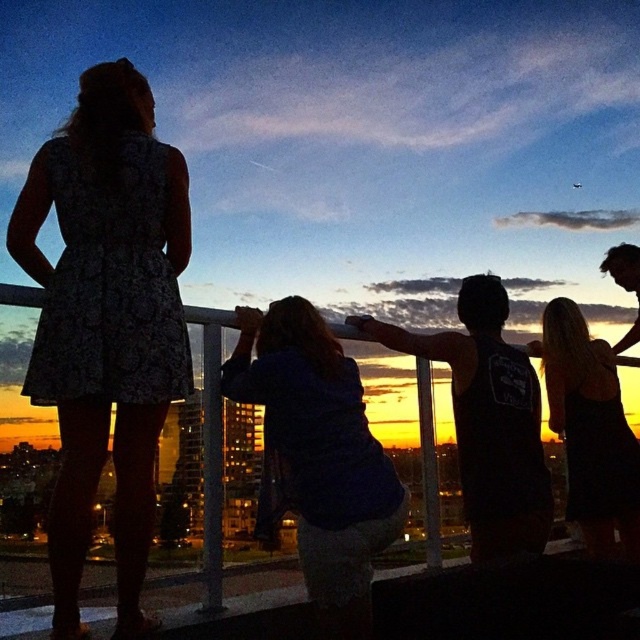
Question: Which point is closer to the camera taking this photo?

Choices:
 (A) (340, 500)
 (B) (612, 426)
 (C) (72, 122)

Answer: (C)

Question: Is floral dress at left behind satin black dress at upper right?

Choices:
 (A) yes
 (B) no

Answer: (B)

Question: Estimate the real-world distances between objects in this image. Which object is farther from the floral dress at left?

Choices:
 (A) satin black dress at upper right
 (B) blue denim shirt at center

Answer: (A)

Question: Among these points, which one is farthest from the camera?

Choices:
 (A) (122, 253)
 (B) (625, 456)
 (C) (310, 317)

Answer: (B)

Question: Can you confirm if blue denim shirt at center is positioned below satin black dress at upper right?

Choices:
 (A) yes
 (B) no

Answer: (B)

Question: Is floral dress at left above satin black dress at upper right?

Choices:
 (A) yes
 (B) no

Answer: (A)